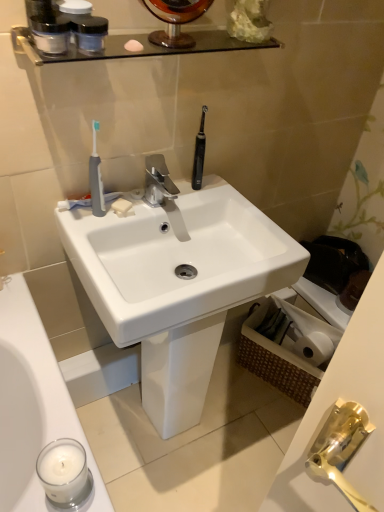
You are a GUI agent. You are given a task and a screenshot of the screen. Output one action in this format:
    pyautogui.click(x=<x>, y=<y>)
    Task: Click on the free space to the left of white matte soap at center
    
    Given the screenshot: What is the action you would take?
    pyautogui.click(x=94, y=210)